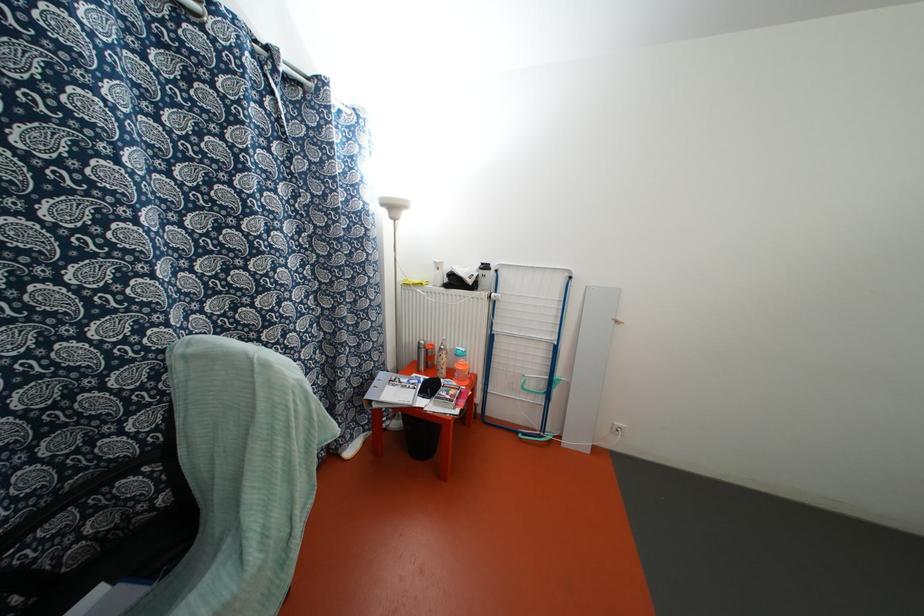
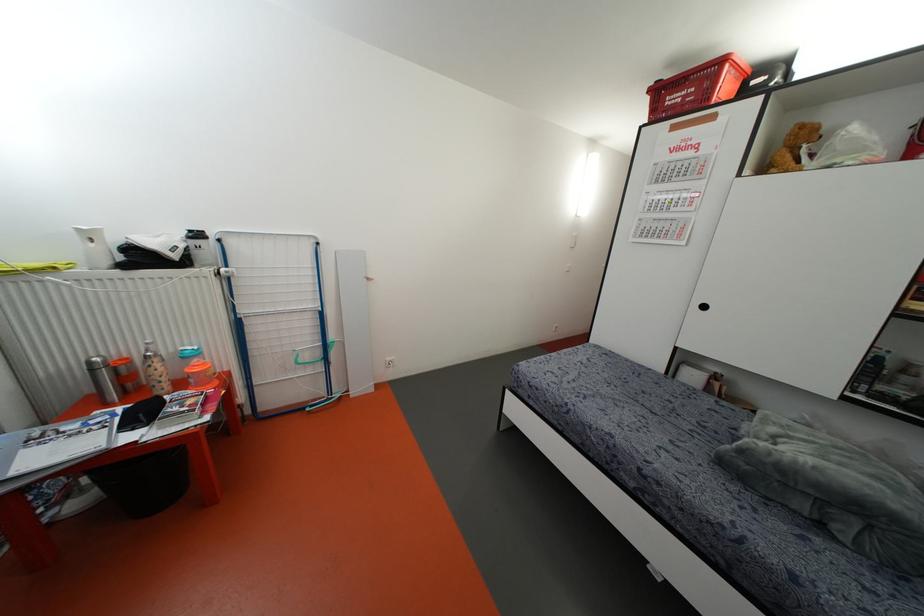
Question: The images are taken continuously from a first-person perspective. In which direction is your viewpoint rotating?

Choices:
 (A) Left
 (B) Right
 (C) Up
 (D) Down

Answer: (B)